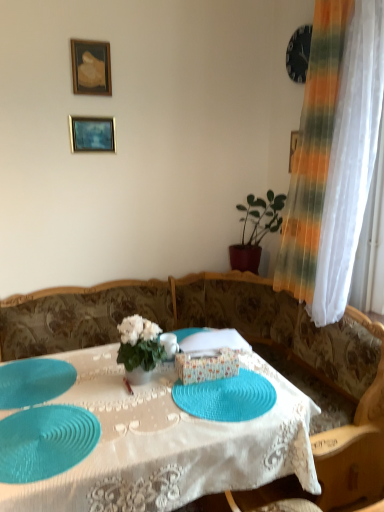
I want to click on vacant space in front of white fabric flower at center, so click(142, 401).